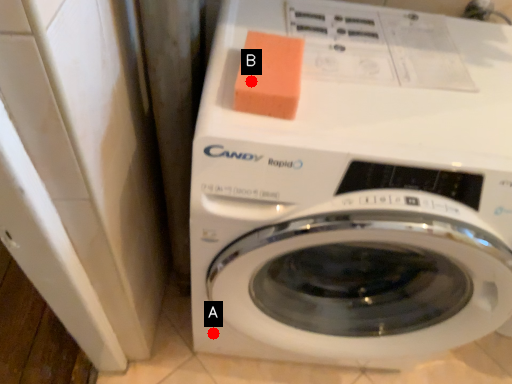
Question: Two points are circled on the image, labeled by A and B beside each circle. Which of the following is the farthest from the observer?

Choices:
 (A) A is further
 (B) B is further

Answer: (A)